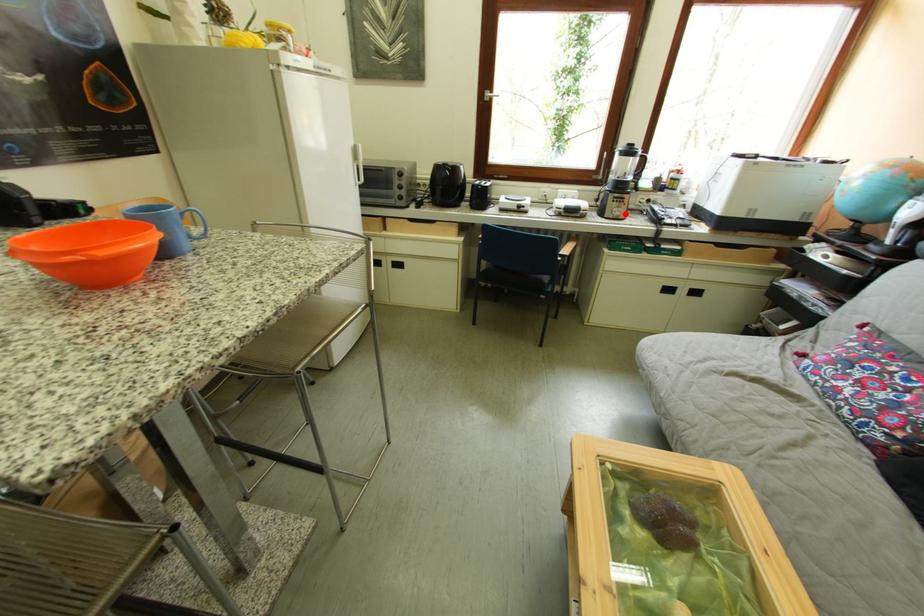
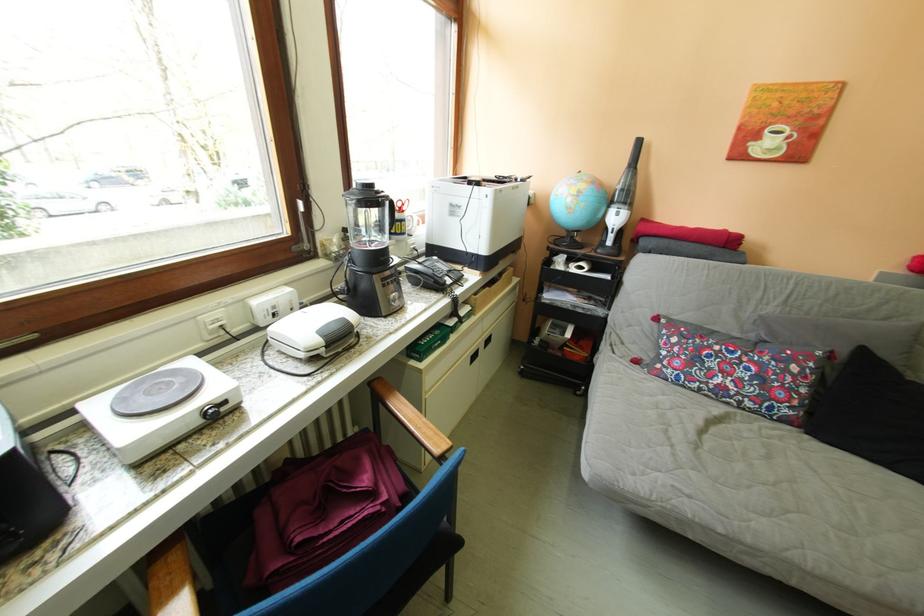
Find the pixel in the second image that matches the highlighted location in the first image.

(402, 304)